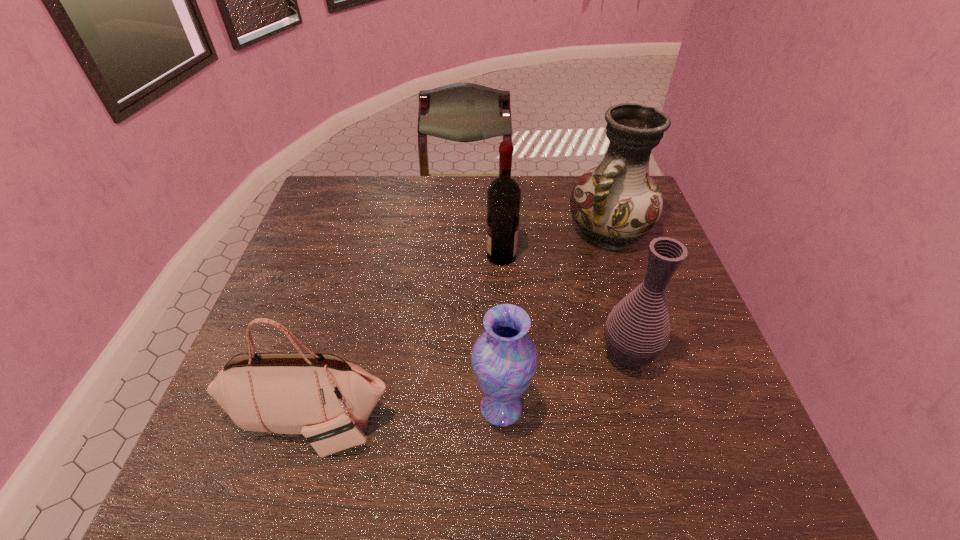
The image size is (960, 540). I want to click on blank space located on the front of the second farthest vase, so click(x=660, y=471).

Locate an element on the screen. This screenshot has width=960, height=540. vacant point located on the side of the handbag with the attached pouch is located at coordinates (289, 492).

Identify the location of free space located 0.260m on the right of the shortest vase. Image resolution: width=960 pixels, height=540 pixels. (659, 407).

You are a GUI agent. You are given a task and a screenshot of the screen. Output one action in this format:
    pyautogui.click(x=<x>, y=<y>)
    Task: Click on the object situated at the far edge
    The image size is (960, 540).
    Given the screenshot: What is the action you would take?
    pyautogui.click(x=617, y=202)

You are a GUI agent. You are given a task and a screenshot of the screen. Output one action in this format:
    pyautogui.click(x=<x>, y=<y>)
    Task: Click on the object that is at the near edge
    This screenshot has width=960, height=540.
    Given the screenshot: What is the action you would take?
    pyautogui.click(x=328, y=400)

You are a GUI agent. You are given a task and a screenshot of the screen. Output one action in this format:
    pyautogui.click(x=<x>, y=<y>)
    Task: Click on the object that is at the left edge
    The image size is (960, 540).
    Given the screenshot: What is the action you would take?
    pyautogui.click(x=328, y=400)

Find the location of `object that is positioned at the near left corner`. object that is positioned at the near left corner is located at coordinates tap(328, 400).

In order to click on object positioned at the far right corner in this screenshot , I will do `click(617, 202)`.

The height and width of the screenshot is (540, 960). I want to click on vacant space at the far edge of the desktop, so click(x=451, y=198).

In the image, there is a desktop. What are the coordinates of `vacant space at the left edge` in the screenshot? It's located at (253, 443).